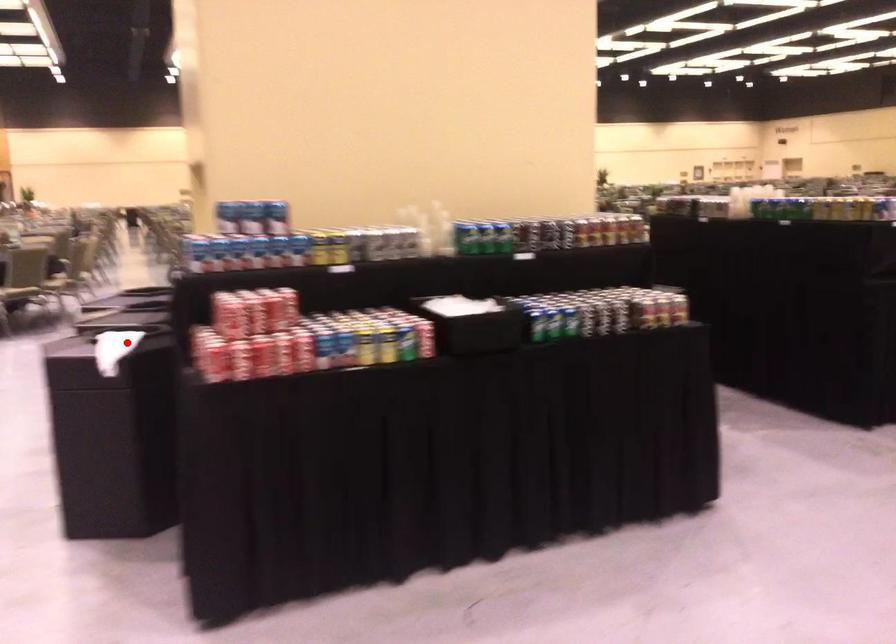
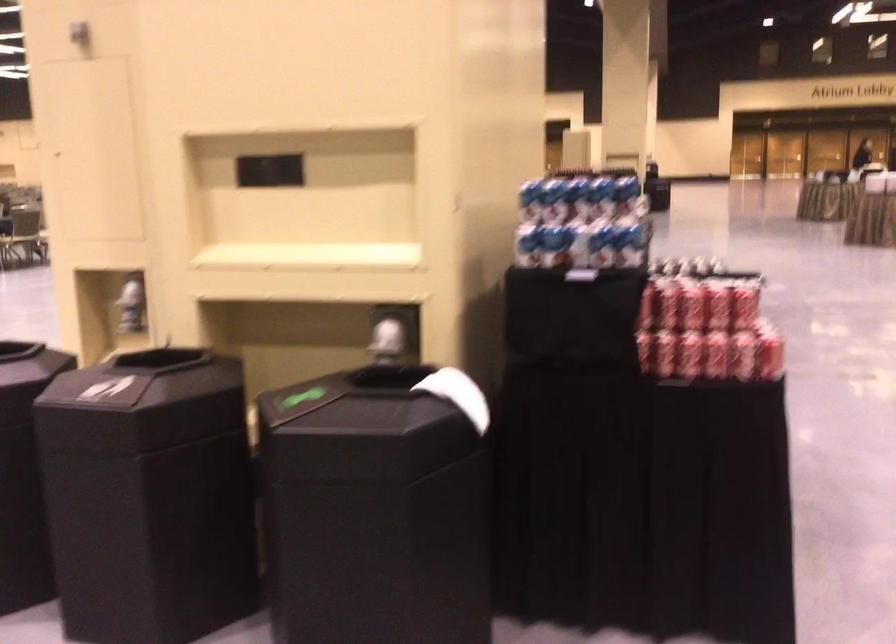
Where in the second image is the point corresponding to the highlighted location from the first image?

(458, 395)